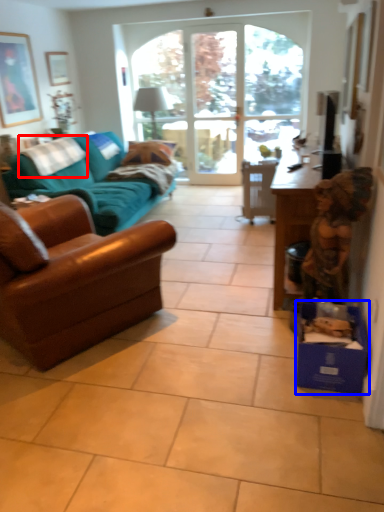
Question: Which of the following is the closest to the observer, pillow (highlighted by a red box) or cardboard box (highlighted by a blue box)?

Choices:
 (A) pillow
 (B) cardboard box

Answer: (B)